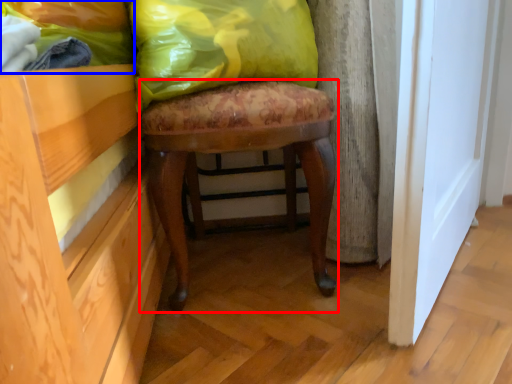
Question: Which object is closer to the camera taking this photo, stool (highlighted by a red box) or fabric (highlighted by a blue box)?

Choices:
 (A) stool
 (B) fabric

Answer: (B)